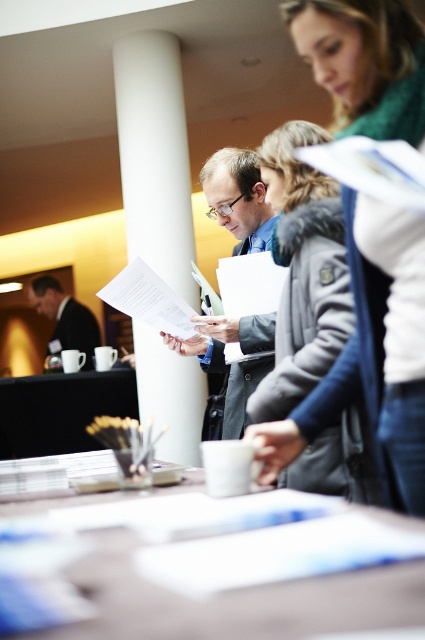
Does white paper at upper center have a lesser height compared to white paper at center?

Yes.

You are a GUI agent. You are given a task and a screenshot of the screen. Output one action in this format:
    pyautogui.click(x=<x>, y=<y>)
    Task: Click on the white paper at upper center
    This screenshot has height=640, width=425.
    Given the screenshot: What is the action you would take?
    pyautogui.click(x=373, y=168)

Locate an element on the screen. The image size is (425, 640). white paper at upper center is located at coordinates (373, 168).

Does green scarf at upper right have a greater height compared to matte black suit at center?

Correct, green scarf at upper right is much taller as matte black suit at center.

I want to click on green scarf at upper right, so click(360, 388).

Is green scarf at upper right positioned before matte black mug at lower left?

Yes, green scarf at upper right is closer to the viewer.

This screenshot has height=640, width=425. I want to click on green scarf at upper right, so click(360, 388).

Which is in front, point (413, 129) or point (64, 339)?

Positioned in front is point (413, 129).

Locate an element on the screen. green scarf at upper right is located at coordinates (360, 388).